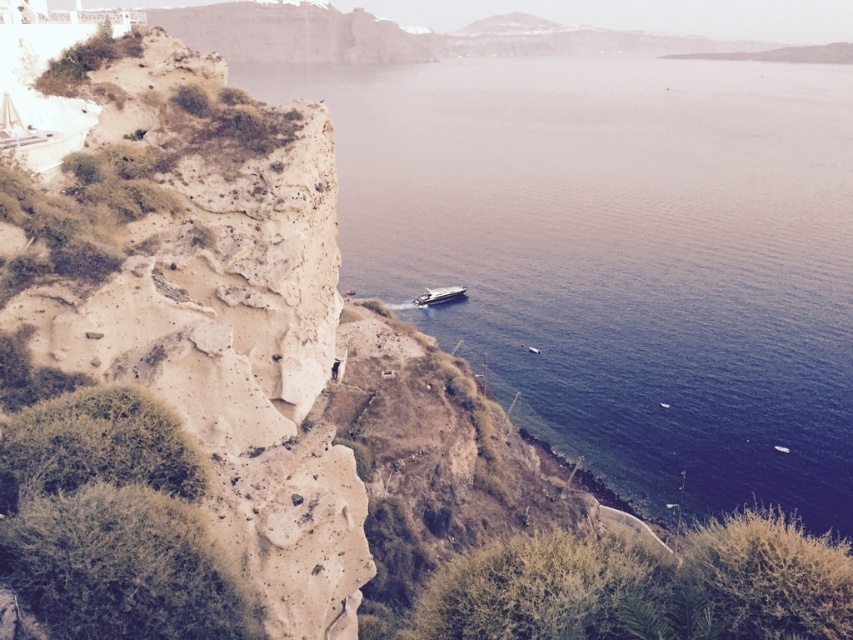
Does beige rock at left have a larger size compared to metallic silver boat at center?

Yes, beige rock at left is bigger than metallic silver boat at center.

Does beige rock at left have a smaller size compared to metallic silver boat at center?

Incorrect, beige rock at left is not smaller in size than metallic silver boat at center.

Is point (167, 604) closer to camera compared to point (457, 296)?

Yes, point (167, 604) is in front of point (457, 296).

Where is `beige rock at left`? beige rock at left is located at coordinates (204, 308).

Between point (714, 445) and point (39, 275), which one is positioned behind?

Positioned behind is point (714, 445).

Between point (843, 273) and point (276, 426), which one is positioned behind?

The point (843, 273) is more distant.

Image resolution: width=853 pixels, height=640 pixels. I want to click on blue water at center, so click(x=622, y=256).

In the scene shown: Who is more distant from viewer, (381, 131) or (437, 294)?

The point (381, 131) is behind.

Describe the element at coordinates (622, 256) in the screenshot. I see `blue water at center` at that location.

Is point (751, 163) positioned behind point (439, 296)?

Yes, point (751, 163) is farther from viewer.

Where is `blue water at center`? The width and height of the screenshot is (853, 640). blue water at center is located at coordinates (622, 256).